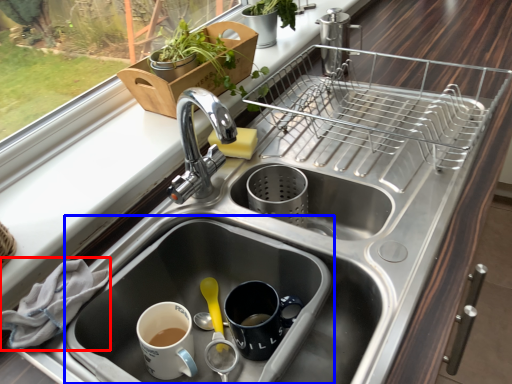
Question: Among these objects, which one is farthest to the camera, material (highlighted by a red box) or sink (highlighted by a blue box)?

Choices:
 (A) material
 (B) sink

Answer: (A)